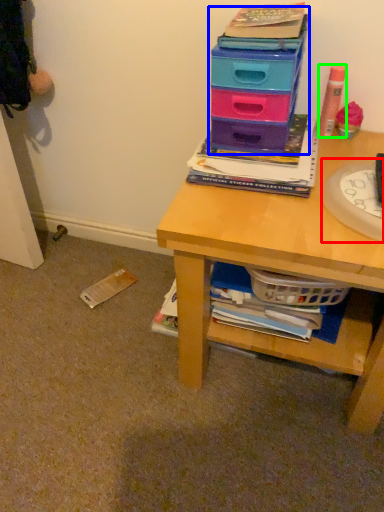
Question: Based on their relative distances, which object is farther from paper plate (highlighted by a red box)? Choose from box (highlighted by a blue box) and stationery (highlighted by a green box).

Choices:
 (A) box
 (B) stationery

Answer: (B)